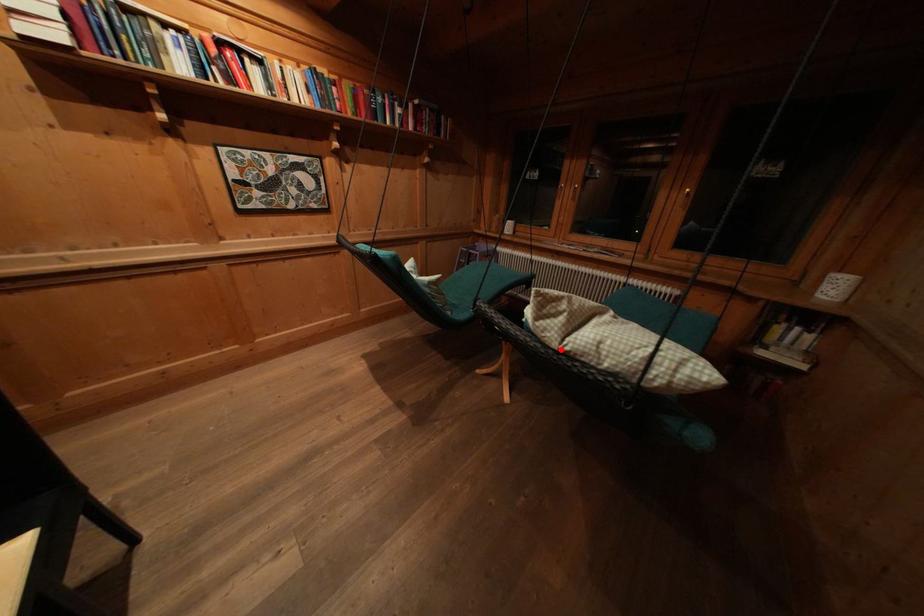
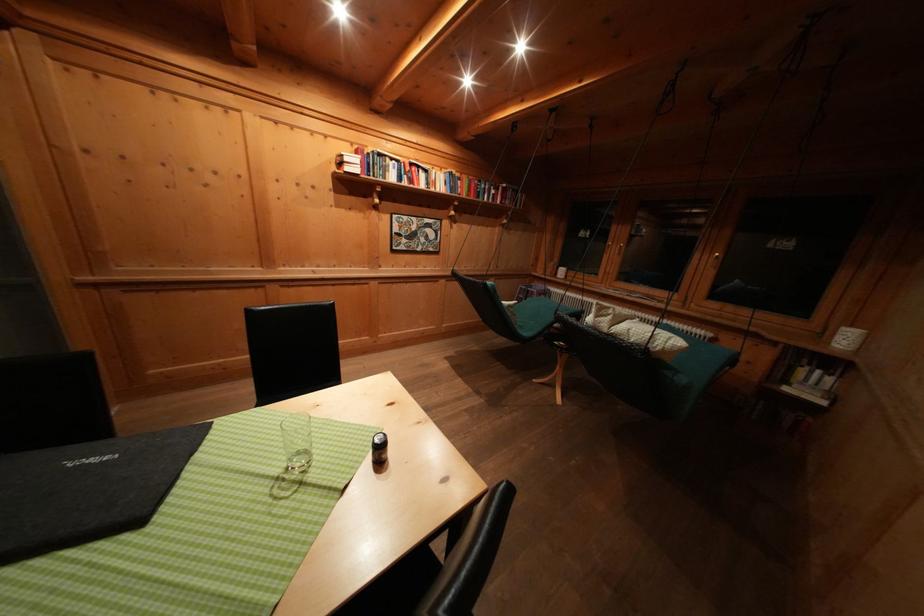
Locate, in the second image, the point that corresponds to the highlighted location in the first image.

(612, 334)